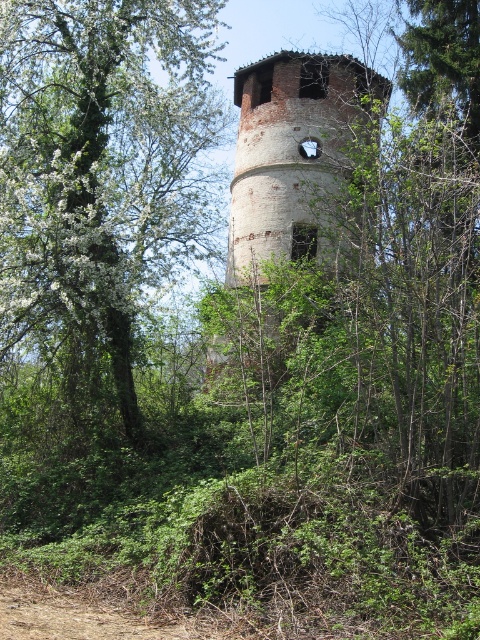
You are a hiker who has stumbled upon this old brick tower in the forest. You notice a green leafy tree at center and a brick tower at center. Which object is closer to you based on their positions?

The green leafy tree at center is positioned under the brick tower at center, meaning the tree is closer to you than the tower.

You are a park ranger planning to clear a path between the green leafy tree at center and the brick tower at center. Your equipment can handle obstacles up to 5 meters apart. Will you need additional tools to manage the gap between them?

The distance between the green leafy tree at center and the brick tower at center is 5.15 meters, which exceeds the equipment limit of 5 meters. Therefore, additional tools will be required to manage the gap between them.

You are a hiker who wants to take a photo of the brick tower at center without any obstructions. Considering the green leafy tree at center, which is narrower than the tower, can you suggest a position where you can stand to ensure the tree doesn

The green leafy tree at center is narrower than the brick tower at center, so standing to the side of the tree would allow you to frame the tower without the tree blocking the entire view. Position yourself either to the left or right of the tree where its narrower width won